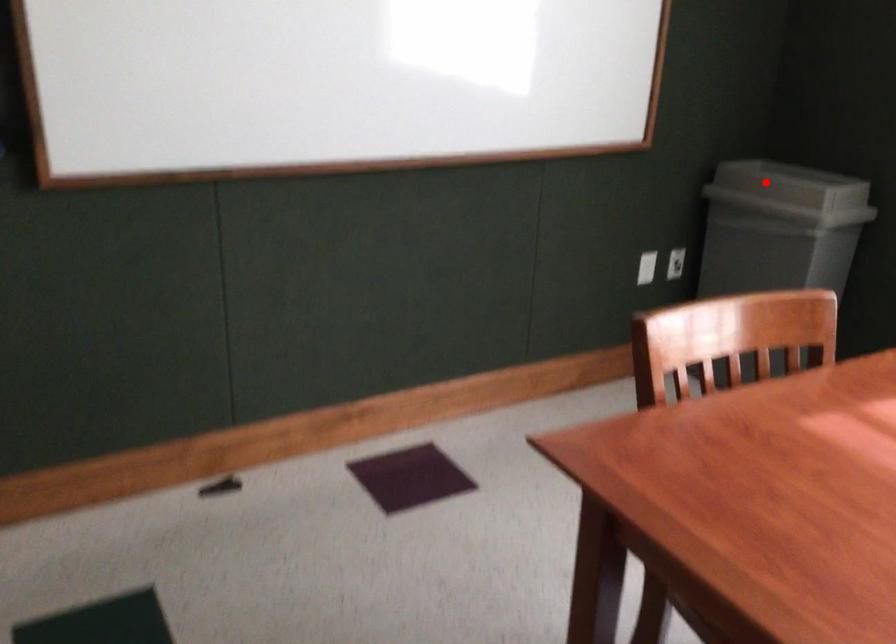
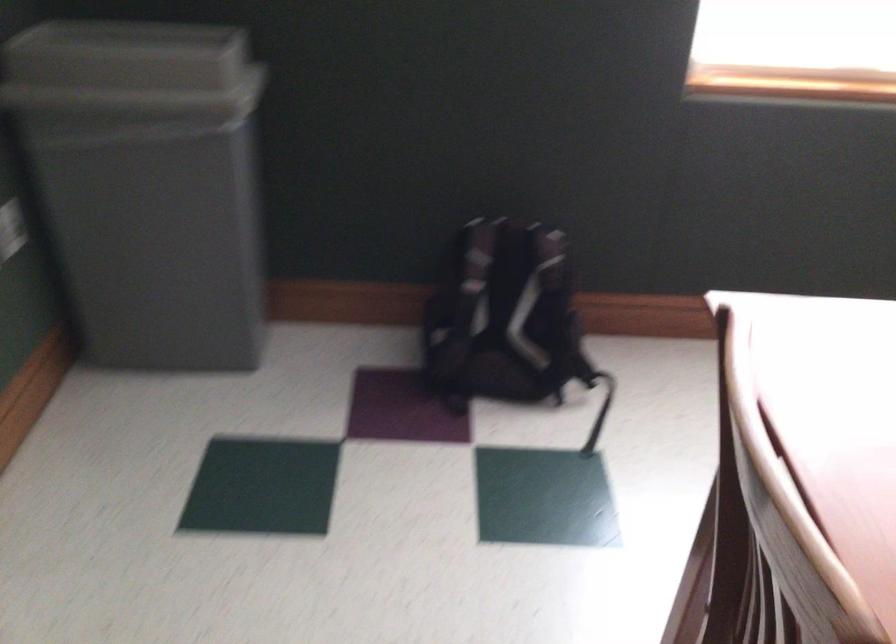
In the second image, find the point that corresponds to the highlighted location in the first image.

(131, 71)